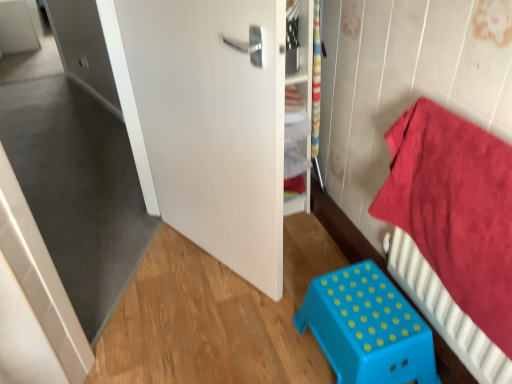
What do you see at coordinates (367, 328) in the screenshot? I see `blue plastic stool at lower center` at bounding box center [367, 328].

Locate an element on the screen. Image resolution: width=512 pixels, height=384 pixels. white matte door at center is located at coordinates (214, 124).

Is blue plastic stool at lower center facing away from red cotton towel at right?

Yes, red cotton towel at right is at the back of blue plastic stool at lower center.

Is blue plastic stool at lower center in contact with red cotton towel at right?

No, blue plastic stool at lower center is not beside red cotton towel at right.

From a real-world perspective, is blue plastic stool at lower center positioned under red cotton towel at right based on gravity?

Yes.

The image size is (512, 384). In the image, there is a red cotton towel at right. Find the location of `furniture below it (from a real-world perspective)`. furniture below it (from a real-world perspective) is located at coordinates (367, 328).

Does red cotton towel at right come behind blue plastic stool at lower center?

No, red cotton towel at right is in front of blue plastic stool at lower center.

Which of these two, red cotton towel at right or blue plastic stool at lower center, is smaller?

With smaller size is blue plastic stool at lower center.

In the scene shown: From the image's perspective, relative to blue plastic stool at lower center, is red cotton towel at right above or below?

red cotton towel at right is above blue plastic stool at lower center.

From a real-world perspective, relative to white matte door at center, is red cotton towel at right vertically above or below?

In terms of real-world spatial position, red cotton towel at right is below white matte door at center.

Relative to white matte door at center, is red cotton towel at right in front or behind?

red cotton towel at right is in front of white matte door at center.

Is red cotton towel at right positioned beyond the bounds of white matte door at center?

Absolutely, red cotton towel at right is external to white matte door at center.

Between red cotton towel at right and white matte door at center, which one has more height?

white matte door at center.

Is blue plastic stool at lower center turned away from white matte door at center?

No.

Is blue plastic stool at lower center far away from white matte door at center?

No, there isn't a large distance between blue plastic stool at lower center and white matte door at center.

Is blue plastic stool at lower center situated inside white matte door at center or outside?

blue plastic stool at lower center is outside white matte door at center.

Between white matte door at center and blue plastic stool at lower center, which one is positioned in front?

white matte door at center.

From a real-world perspective, is white matte door at center located beneath blue plastic stool at lower center?

No.

Looking at their sizes, would you say white matte door at center is wider or thinner than blue plastic stool at lower center?

Clearly, white matte door at center has less width compared to blue plastic stool at lower center.

How different are the orientations of white matte door at center and blue plastic stool at lower center in degrees?

There is a 23.6-degree angle between the facing directions of white matte door at center and blue plastic stool at lower center.

Could you tell me if white matte door at center is turned towards red cotton towel at right?

No, white matte door at center is not turned towards red cotton towel at right.

Can you confirm if white matte door at center is shorter than red cotton towel at right?

No, white matte door at center is not shorter than red cotton towel at right.

Looking at this image, which is more to the left, white matte door at center or red cotton towel at right?

white matte door at center is more to the left.

Would you say white matte door at center is outside red cotton towel at right?

Yes, white matte door at center is located beyond the bounds of red cotton towel at right.

You are a GUI agent. You are given a task and a screenshot of the screen. Output one action in this format:
    pyautogui.click(x=<x>, y=<y>)
    Task: Click on the bedding to the right of blue plastic stool at lower center
    This screenshot has width=512, height=384.
    Given the screenshot: What is the action you would take?
    pyautogui.click(x=455, y=209)

I want to click on furniture on the left side of red cotton towel at right, so click(x=367, y=328).

When comparing their distances from blue plastic stool at lower center, does red cotton towel at right or white matte door at center seem further?

white matte door at center is further to blue plastic stool at lower center.

When comparing their distances from white matte door at center, does red cotton towel at right or blue plastic stool at lower center seem further?

Among the two, red cotton towel at right is located further to white matte door at center.

When comparing their distances from red cotton towel at right, does blue plastic stool at lower center or white matte door at center seem further?

white matte door at center.

Based on the photo, from the image, which object appears to be farther from blue plastic stool at lower center, white matte door at center or red cotton towel at right?

white matte door at center lies further to blue plastic stool at lower center than the other object.

When comparing their distances from red cotton towel at right, does white matte door at center or blue plastic stool at lower center seem further?

white matte door at center is further to red cotton towel at right.

Looking at the image, which one is located further to white matte door at center, blue plastic stool at lower center or red cotton towel at right?

Based on the image, red cotton towel at right appears to be further to white matte door at center.

Where is `furniture between white matte door at center and red cotton towel at right in the horizontal direction`? Image resolution: width=512 pixels, height=384 pixels. furniture between white matte door at center and red cotton towel at right in the horizontal direction is located at coordinates (367, 328).